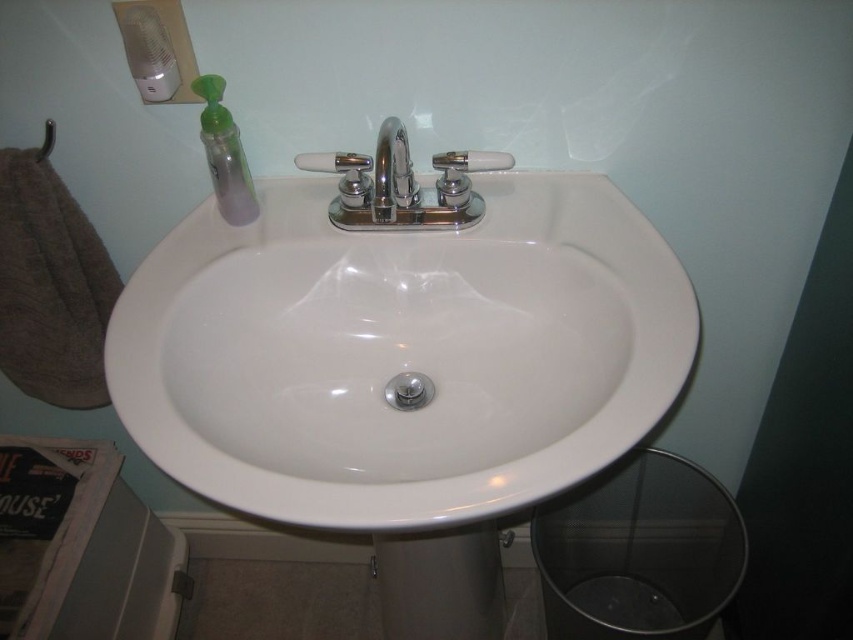
You are organizing items in the bathroom and need to place a new white frosted glass soap at center. The current setup has a white glossy sink at center. Where should you position the new soap relative to the sink?

The white frosted glass soap at center should be placed to the right of the white glossy sink at center because the existing setup has the sink to the left of the soap.

You are a maintenance worker who needs to check the distance between the white glossy sink at center and the matte plastic soap dispenser at upper left. Can you confirm if the distance is more than 30 centimeters?

The distance between the white glossy sink at center and the matte plastic soap dispenser at upper left is 36.79 centimeters, which is more than 30 centimeters.

You are trying to reach the white frosted glass soap at center while standing in front of the white glossy sink at center. Can you easily access it without moving the sink?

The white glossy sink at center is in front of the white frosted glass soap at center, so you cannot easily access the soap without moving the sink.